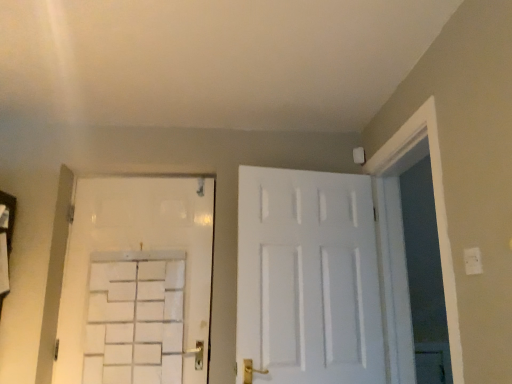
Question: Is white plastic electric outlet at upper right at the right side of white matte door at center, which is the 2th door from left to right?

Choices:
 (A) yes
 (B) no

Answer: (A)

Question: From a real-world perspective, is white plastic electric outlet at upper right on top of white matte door at center, positioned as the 1th door in right-to-left order?

Choices:
 (A) yes
 (B) no

Answer: (B)

Question: From the image's perspective, does white plastic electric outlet at upper right appear higher than white matte door at center, positioned as the 1th door in right-to-left order?

Choices:
 (A) yes
 (B) no

Answer: (A)

Question: Are white plastic electric outlet at upper right and white matte door at center, which is the 2th door from left to right, beside each other?

Choices:
 (A) no
 (B) yes

Answer: (A)

Question: Is white plastic electric outlet at upper right at the left side of white matte door at center, which is the 2th door from left to right?

Choices:
 (A) no
 (B) yes

Answer: (A)

Question: Is white plastic electric outlet at upper right bigger than white matte door at center, which is the 2th door from left to right?

Choices:
 (A) yes
 (B) no

Answer: (B)

Question: Is white matte door at center, positioned as the 1th door in right-to-left order, oriented away from white plastic electric outlet at upper right?

Choices:
 (A) yes
 (B) no

Answer: (B)

Question: Is white matte door at center, which is the 2th door from left to right, thinner than white plastic electric outlet at upper right?

Choices:
 (A) no
 (B) yes

Answer: (A)

Question: From the image's perspective, is white matte door at center, positioned as the 1th door in right-to-left order, beneath white plastic electric outlet at upper right?

Choices:
 (A) yes
 (B) no

Answer: (A)

Question: Does white matte door at center, positioned as the 1th door in right-to-left order, appear on the right side of white plastic electric outlet at upper right?

Choices:
 (A) no
 (B) yes

Answer: (A)

Question: Is white matte door at center, positioned as the 1th door in right-to-left order, not near white plastic electric outlet at upper right?

Choices:
 (A) yes
 (B) no

Answer: (B)

Question: Does white matte door at center, positioned as the 1th door in right-to-left order, appear on the left side of white plastic electric outlet at upper right?

Choices:
 (A) yes
 (B) no

Answer: (A)